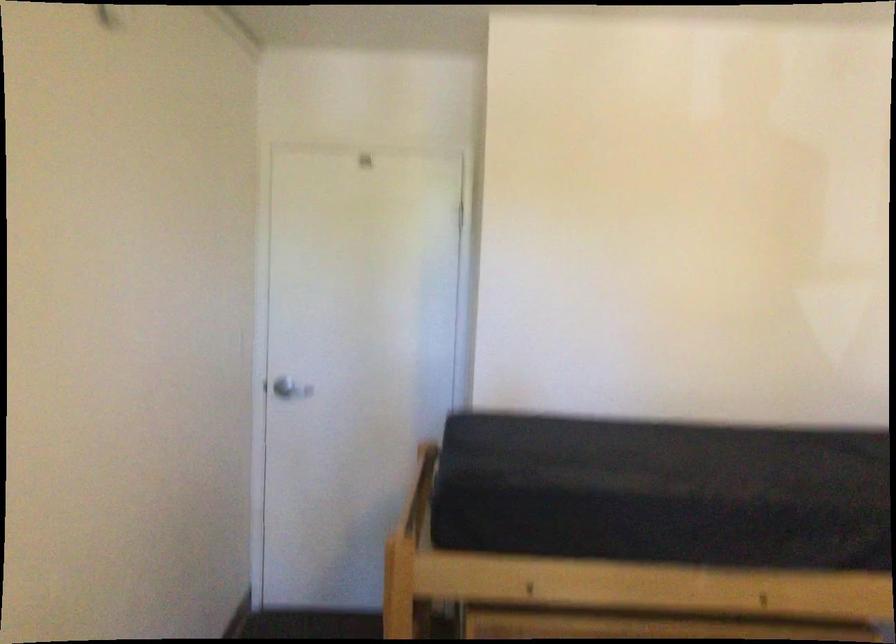
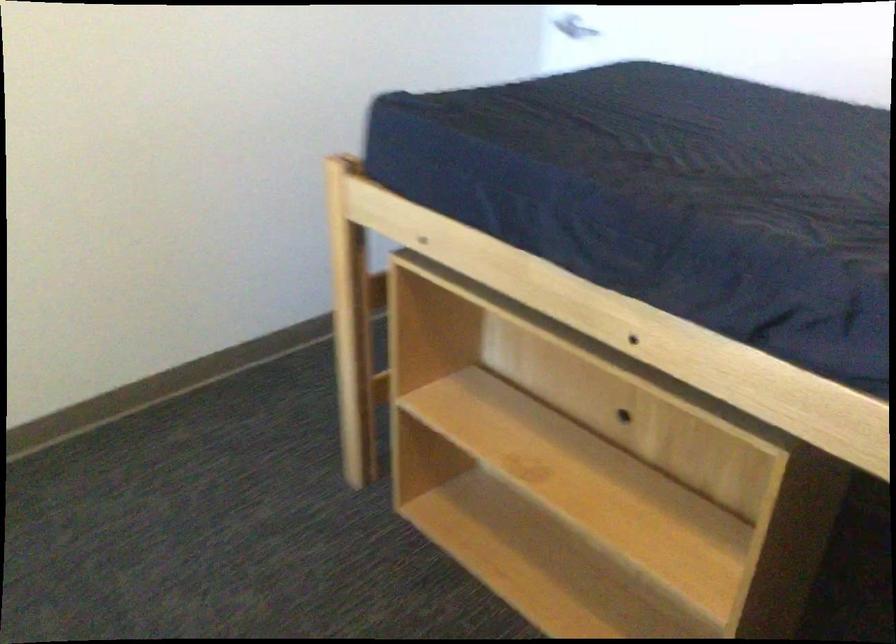
The point at (730, 496) is marked in the first image. Where is the corresponding point in the second image?

(651, 193)